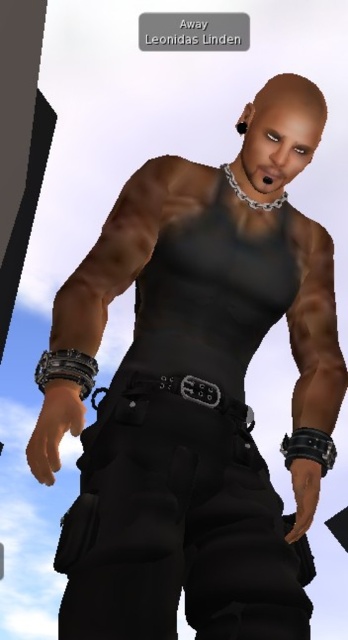
You are a fashion designer analyzing the character. Which item is positioned higher on the character, the matte black tank top at center or the black leather belt at center?

The matte black tank top at center is taller than the black leather belt at center.

You are a photographer trying to capture the character in the image. You want to ensure that the point at point [258,538] is in focus. Given that your camera has a depth of field that can sharply focus objects within 4 feet from the camera, will this point be in focus?

The point [258,538] is 3.99 feet from the camera, which is within the 4 feet depth of field. Therefore, the point will be in focus.